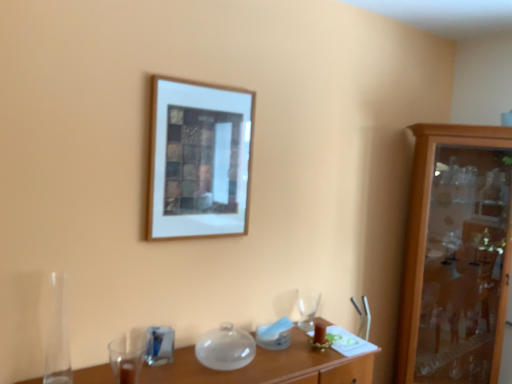
Question: Does wooden cabinet at right appear on the left side of blue glass at lower left, the 2th tableware in the back-to-front sequence?

Choices:
 (A) no
 (B) yes

Answer: (A)

Question: Considering the relative sizes of wooden cabinet at right and blue glass at lower left, the 2th tableware positioned from the right, in the image provided, is wooden cabinet at right thinner than blue glass at lower left, the 2th tableware positioned from the right,?

Choices:
 (A) yes
 (B) no

Answer: (B)

Question: Does wooden cabinet at right touch blue glass at lower left, the 1th tableware in the front-to-back sequence?

Choices:
 (A) no
 (B) yes

Answer: (A)

Question: Would you say blue glass at lower left, the 1th tableware in the front-to-back sequence, is part of wooden cabinet at right's contents?

Choices:
 (A) yes
 (B) no

Answer: (B)

Question: From the image's perspective, is wooden cabinet at right located above blue glass at lower left, the first tableware positioned from the left?

Choices:
 (A) yes
 (B) no

Answer: (A)

Question: Looking at the image, does blue glass at lower left, the first tableware positioned from the left, seem bigger or smaller compared to translucent glass table at lower center?

Choices:
 (A) big
 (B) small

Answer: (B)

Question: In the image, is blue glass at lower left, the 2th tableware in the back-to-front sequence, positioned in front of or behind translucent glass table at lower center?

Choices:
 (A) front
 (B) behind

Answer: (B)

Question: Which is correct: blue glass at lower left, the first tableware positioned from the left, is inside translucent glass table at lower center, or outside of it?

Choices:
 (A) inside
 (B) outside

Answer: (B)

Question: Would you say blue glass at lower left, the 1th tableware in the front-to-back sequence, is to the left or to the right of translucent glass table at lower center in the picture?

Choices:
 (A) right
 (B) left

Answer: (B)

Question: From a real-world perspective, is clear glass wine glass at center, marked as the 1th tableware in a right-to-left arrangement, positioned above or below wooden cabinet at right?

Choices:
 (A) above
 (B) below

Answer: (B)

Question: Considering the positions of clear glass wine glass at center, the 2th tableware when ordered from left to right, and wooden cabinet at right in the image, is clear glass wine glass at center, the 2th tableware when ordered from left to right, wider or thinner than wooden cabinet at right?

Choices:
 (A) thin
 (B) wide

Answer: (A)

Question: Is clear glass wine glass at center, the second tableware viewed from the front, taller or shorter than wooden cabinet at right?

Choices:
 (A) tall
 (B) short

Answer: (B)

Question: From the image's perspective, is clear glass wine glass at center, marked as the 1th tableware in a right-to-left arrangement, above or below wooden cabinet at right?

Choices:
 (A) below
 (B) above

Answer: (A)

Question: Considering the positions of transparent glass vase at lower left and wooden cabinet at right in the image, is transparent glass vase at lower left bigger or smaller than wooden cabinet at right?

Choices:
 (A) big
 (B) small

Answer: (B)

Question: Choose the correct answer: Is transparent glass vase at lower left inside wooden cabinet at right or outside it?

Choices:
 (A) inside
 (B) outside

Answer: (B)